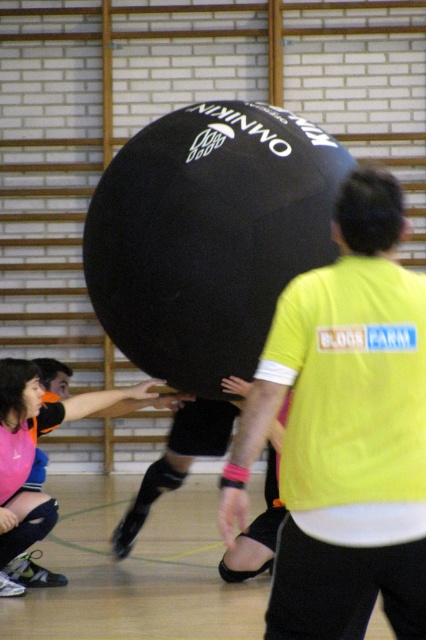
Question: Does yellow fabric shirt at center lie in front of matte pink shorts at lower left?

Choices:
 (A) yes
 (B) no

Answer: (A)

Question: Among these points, which one is nearest to the camera?

Choices:
 (A) (31, 392)
 (B) (425, 348)

Answer: (B)

Question: Is yellow fabric shirt at center to the right of matte pink shorts at lower left from the viewer's perspective?

Choices:
 (A) yes
 (B) no

Answer: (A)

Question: Does yellow fabric shirt at center appear under matte pink shorts at lower left?

Choices:
 (A) yes
 (B) no

Answer: (B)

Question: Which point appears farthest from the camera in this image?

Choices:
 (A) (17, 406)
 (B) (373, 333)

Answer: (A)